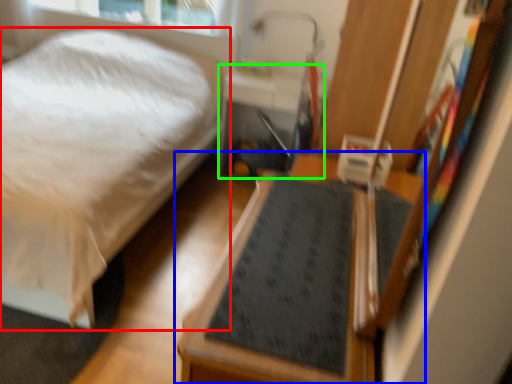
Question: Which is nearer to the bed (highlighted by a red box)? furniture (highlighted by a blue box) or table (highlighted by a green box).

Choices:
 (A) furniture
 (B) table

Answer: (B)